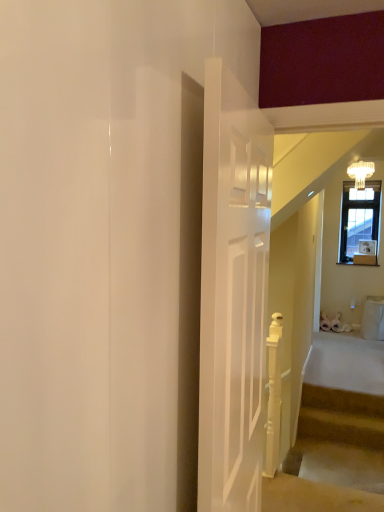
The image size is (384, 512). What do you see at coordinates (360, 173) in the screenshot?
I see `white glass chandelier at upper right` at bounding box center [360, 173].

The image size is (384, 512). Identify the location of white glass chandelier at upper right. (360, 173).

You are a GUI agent. You are given a task and a screenshot of the screen. Output one action in this format:
    pyautogui.click(x=<x>, y=<y>)
    Task: Click on the carpeted stairs at lower right
    The width and height of the screenshot is (384, 512).
    Given the screenshot: What is the action you would take?
    pyautogui.click(x=342, y=417)

The image size is (384, 512). What do you see at coordinates (342, 417) in the screenshot?
I see `carpeted stairs at lower right` at bounding box center [342, 417].

Image resolution: width=384 pixels, height=512 pixels. In order to click on white glass chandelier at upper right in this screenshot , I will do `click(360, 173)`.

Does carpeted stairs at lower right appear on the left side of white glass chandelier at upper right?

Indeed, carpeted stairs at lower right is positioned on the left side of white glass chandelier at upper right.

Is carpeted stairs at lower right behind white glass chandelier at upper right?

No.

In the scene shown: Which point is more forward, (339, 399) or (355, 172)?

Point (339, 399)

From the image's perspective, which is below, carpeted stairs at lower right or white glass chandelier at upper right?

carpeted stairs at lower right.

From a real-world perspective, between carpeted stairs at lower right and white glass chandelier at upper right, who is vertically higher?

From a 3D spatial view, white glass chandelier at upper right is above.

Considering the relative sizes of carpeted stairs at lower right and white glass chandelier at upper right in the image provided, is carpeted stairs at lower right wider than white glass chandelier at upper right?

In fact, carpeted stairs at lower right might be narrower than white glass chandelier at upper right.

Can you confirm if carpeted stairs at lower right is taller than white glass chandelier at upper right?

Incorrect, the height of carpeted stairs at lower right is not larger of that of white glass chandelier at upper right.

Which of these two, carpeted stairs at lower right or white glass chandelier at upper right, is bigger?

carpeted stairs at lower right is bigger.

Is white glass chandelier at upper right completely or partially inside carpeted stairs at lower right?

No, white glass chandelier at upper right is not inside carpeted stairs at lower right.

Is carpeted stairs at lower right placed right next to white glass chandelier at upper right?

carpeted stairs at lower right and white glass chandelier at upper right are not in contact.

In the scene shown: Is carpeted stairs at lower right facing towards white glass chandelier at upper right?

No, carpeted stairs at lower right is not oriented towards white glass chandelier at upper right.

What's the angular difference between carpeted stairs at lower right and white glass chandelier at upper right's facing directions?

The angle between the facing direction of carpeted stairs at lower right and the facing direction of white glass chandelier at upper right is 3.2 degrees.

Locate an element on the screen. The width and height of the screenshot is (384, 512). stairs on the left of white glass chandelier at upper right is located at coordinates (342, 417).

Is white glass chandelier at upper right to the left of carpeted stairs at lower right from the viewer's perspective?

In fact, white glass chandelier at upper right is to the right of carpeted stairs at lower right.

Based on the photo, which object is closer to the camera, white glass chandelier at upper right or carpeted stairs at lower right?

carpeted stairs at lower right.

Is point (369, 174) closer or farther from the camera than point (329, 437)?

Point (369, 174) appears to be farther away from the viewer than point (329, 437).

From the image's perspective, is white glass chandelier at upper right above or below carpeted stairs at lower right?

From the image's perspective, white glass chandelier at upper right appears above carpeted stairs at lower right.

From a real-world perspective, does white glass chandelier at upper right sit lower than carpeted stairs at lower right?

No, from a real-world perspective, white glass chandelier at upper right is not below carpeted stairs at lower right.

Considering the relative sizes of white glass chandelier at upper right and carpeted stairs at lower right in the image provided, is white glass chandelier at upper right wider than carpeted stairs at lower right?

Indeed, white glass chandelier at upper right has a greater width compared to carpeted stairs at lower right.

Which of these two, white glass chandelier at upper right or carpeted stairs at lower right, stands shorter?

Standing shorter between the two is carpeted stairs at lower right.

Considering the sizes of objects white glass chandelier at upper right and carpeted stairs at lower right in the image provided, who is smaller, white glass chandelier at upper right or carpeted stairs at lower right?

white glass chandelier at upper right.

Can carpeted stairs at lower right be found inside white glass chandelier at upper right?

No.

From the picture: Is white glass chandelier at upper right positioned far away from carpeted stairs at lower right?

white glass chandelier at upper right is positioned a significant distance from carpeted stairs at lower right.

Is white glass chandelier at upper right turned away from carpeted stairs at lower right?

No, carpeted stairs at lower right is not at the back of white glass chandelier at upper right.

How many degrees apart are the facing directions of white glass chandelier at upper right and carpeted stairs at lower right?

There is a 3.2-degree angle between the facing directions of white glass chandelier at upper right and carpeted stairs at lower right.

You are a GUI agent. You are given a task and a screenshot of the screen. Output one action in this format:
    pyautogui.click(x=<x>, y=<y>)
    Task: Click on the stairs on the left side of white glass chandelier at upper right
    
    Given the screenshot: What is the action you would take?
    pyautogui.click(x=342, y=417)

Locate an element on the screen. This screenshot has height=512, width=384. light fixture above the carpeted stairs at lower right (from a real-world perspective) is located at coordinates (360, 173).

Find the location of a particular element. This screenshot has height=512, width=384. stairs below the white glass chandelier at upper right (from the image's perspective) is located at coordinates (342, 417).